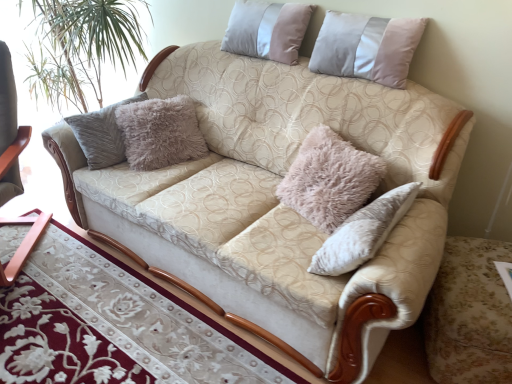
Question: From a real-world perspective, is wooden rocking chair at left physically located above or below silky beige pillow at upper center, placed as the second pillow when sorted from right to left?

Choices:
 (A) above
 (B) below

Answer: (B)

Question: Considering the positions of wooden rocking chair at left and silky beige pillow at upper center, placed as the second pillow when sorted from right to left, in the image, is wooden rocking chair at left taller or shorter than silky beige pillow at upper center, placed as the second pillow when sorted from right to left,?

Choices:
 (A) tall
 (B) short

Answer: (A)

Question: Based on their relative distances, which object is farther from the pale pink velvet pillow at upper right, marked as the first pillow in a right-to-left arrangement?

Choices:
 (A) silky beige pillow at upper center, placed as the second pillow when sorted from right to left
 (B) wooden table at lower left
 (C) wooden rocking chair at left

Answer: (C)

Question: Which object is positioned farthest from the pale pink velvet pillow at upper right, marked as the first pillow in a right-to-left arrangement?

Choices:
 (A) wooden table at lower left
 (B) silky beige pillow at upper center, the first pillow viewed from the left
 (C) wooden rocking chair at left

Answer: (C)